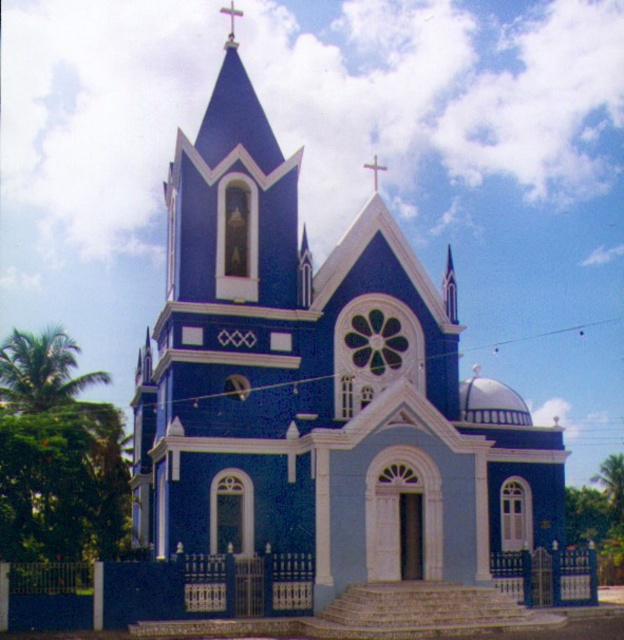
Question: Where is metallic cross at upper center located in relation to metallic gold cross at upper center in the image?

Choices:
 (A) right
 (B) left

Answer: (B)

Question: Which point is farther from the camera taking this photo?

Choices:
 (A) (232, 22)
 (B) (351, 536)
 (C) (376, 168)

Answer: (A)

Question: Which of the following is the closest to the observer?

Choices:
 (A) metallic gold cross at upper center
 (B) blue painted stone church at center
 (C) metallic cross at upper center

Answer: (B)

Question: Is metallic cross at upper center above metallic gold cross at upper center?

Choices:
 (A) yes
 (B) no

Answer: (A)

Question: In this image, where is metallic cross at upper center located relative to metallic gold cross at upper center?

Choices:
 (A) right
 (B) left

Answer: (B)

Question: Which of the following is the closest to the observer?

Choices:
 (A) (227, 10)
 (B) (366, 164)
 (C) (232, 113)

Answer: (C)